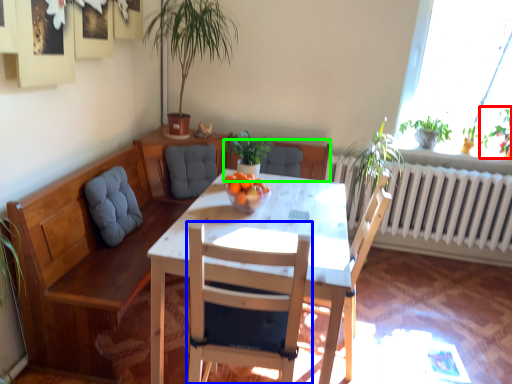
Question: Which object is the closest to the plant (highlighted by a red box)? Choose among these: chair (highlighted by a blue box) or chair (highlighted by a green box).

Choices:
 (A) chair
 (B) chair

Answer: (B)